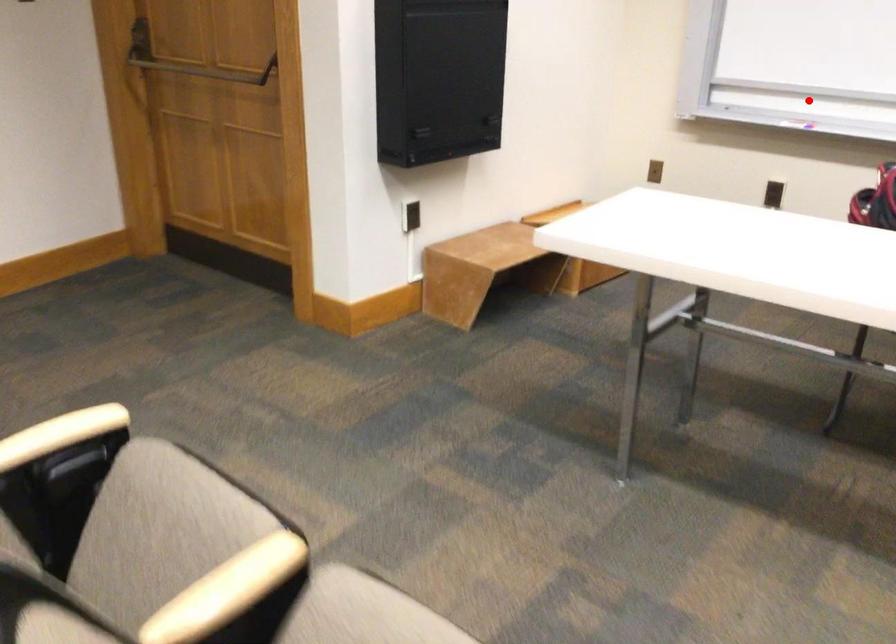
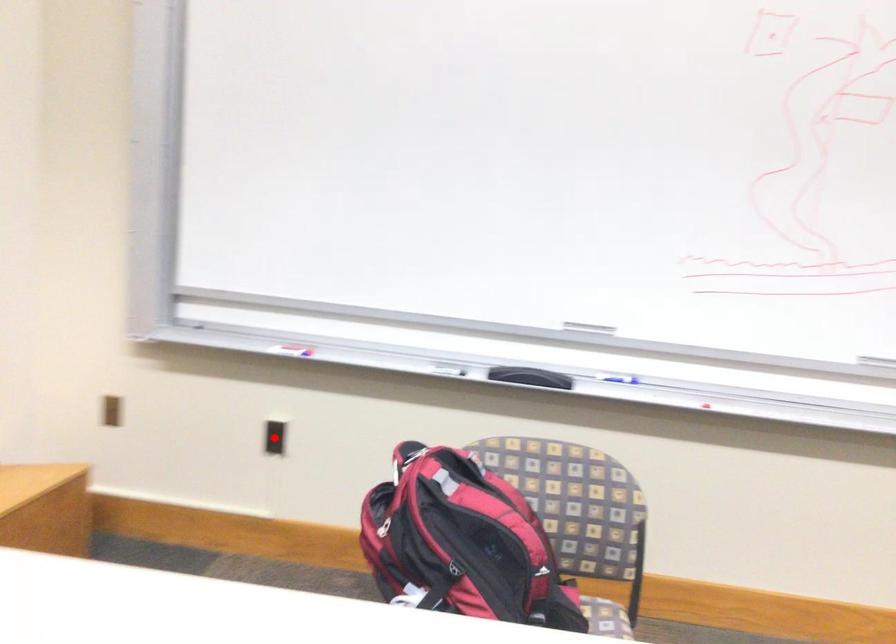
I am providing you with two images of the same scene from different viewpoints. A red point is marked on the first image and another point is marked on the second image. Does the point marked in image1 correspond to the same location as the one in image2?

No